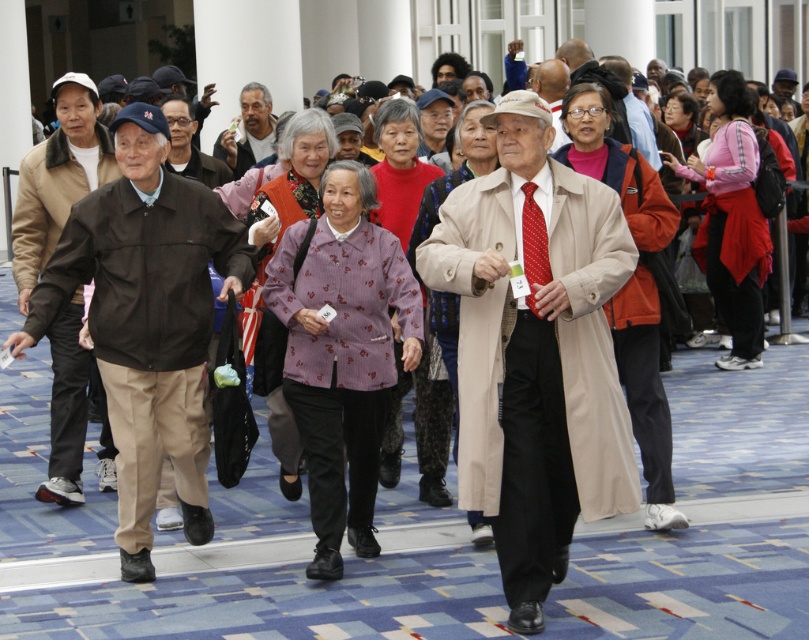
Can you confirm if beige wool coat at center is shorter than matte black jacket at left?

No, beige wool coat at center is not shorter than matte black jacket at left.

Is point (583, 488) positioned behind point (85, 81)?

No, it is in front of (85, 81).

Who is more distant from viewer, (460, 289) or (56, 344)?

Point (56, 344)

I want to click on beige wool coat at center, so click(536, 355).

Does matte brown jacket at left have a greater width compared to matte black jacket at left?

Indeed, matte brown jacket at left has a greater width compared to matte black jacket at left.

Locate an element on the screen. The height and width of the screenshot is (640, 809). matte brown jacket at left is located at coordinates (146, 321).

What are the coordinates of `matte brown jacket at left` in the screenshot? It's located at (146, 321).

Locate an element on the screen. matte brown jacket at left is located at coordinates (146, 321).

Is matte brown jacket at left further to camera compared to red dotted tie at center?

Yes, it is.

The width and height of the screenshot is (809, 640). I want to click on matte brown jacket at left, so click(146, 321).

At what (x,y) coordinates should I click in order to perform the action: click on matte brown jacket at left. Please return your answer as a coordinate pair (x, y). Looking at the image, I should click on (146, 321).